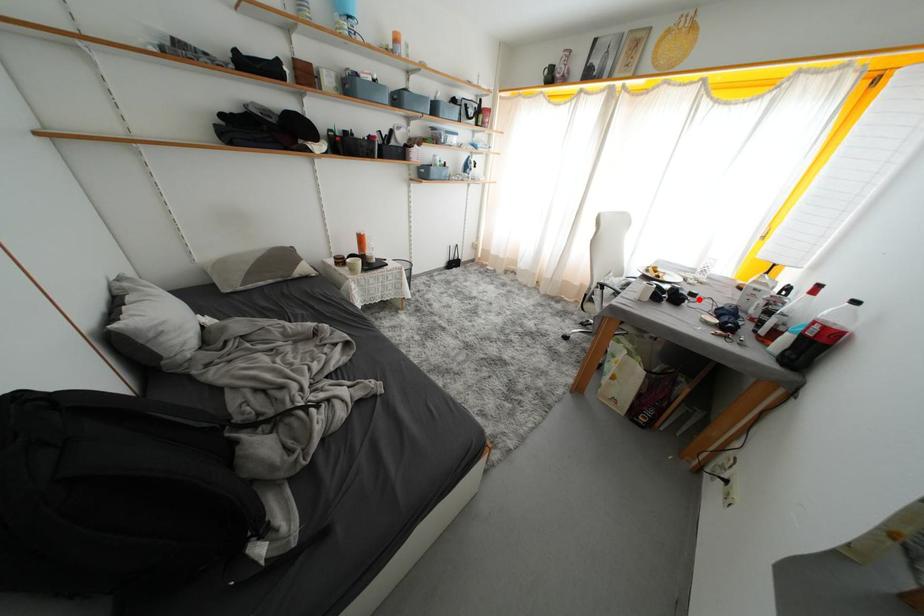
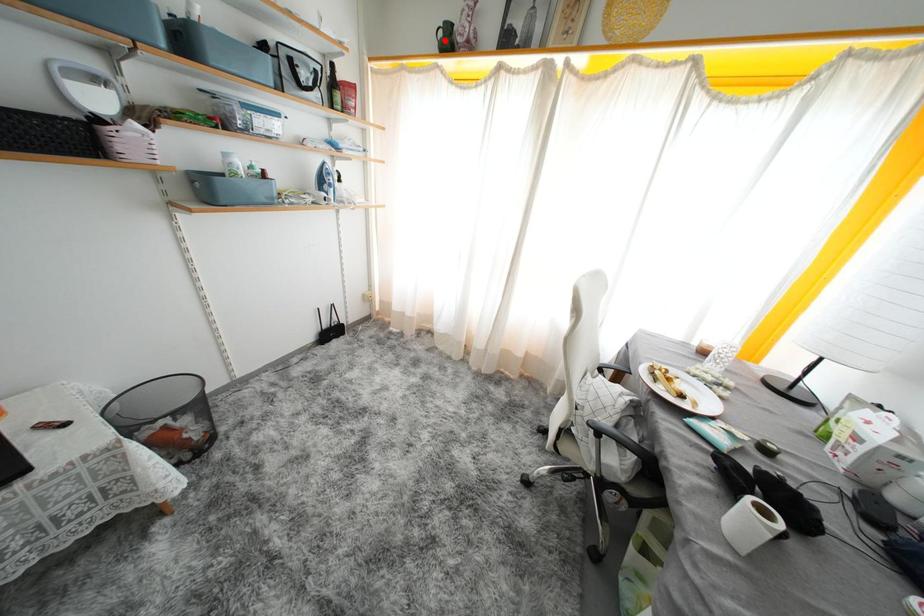
I am providing you with two images of the same scene from different viewpoints. A red point is marked on the first image and another point is marked on the second image. Are the points marked in image1 and image2 representing the same 3D position?

No